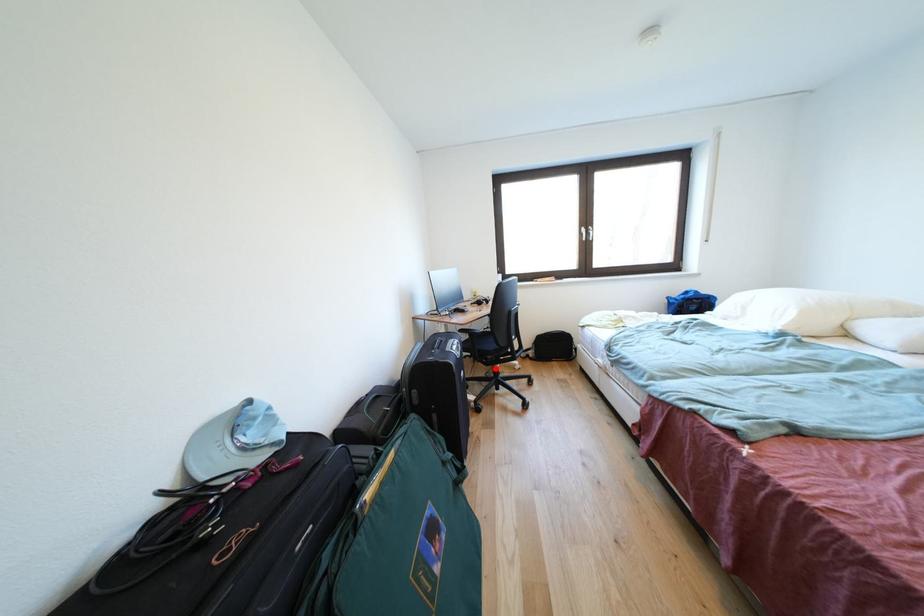
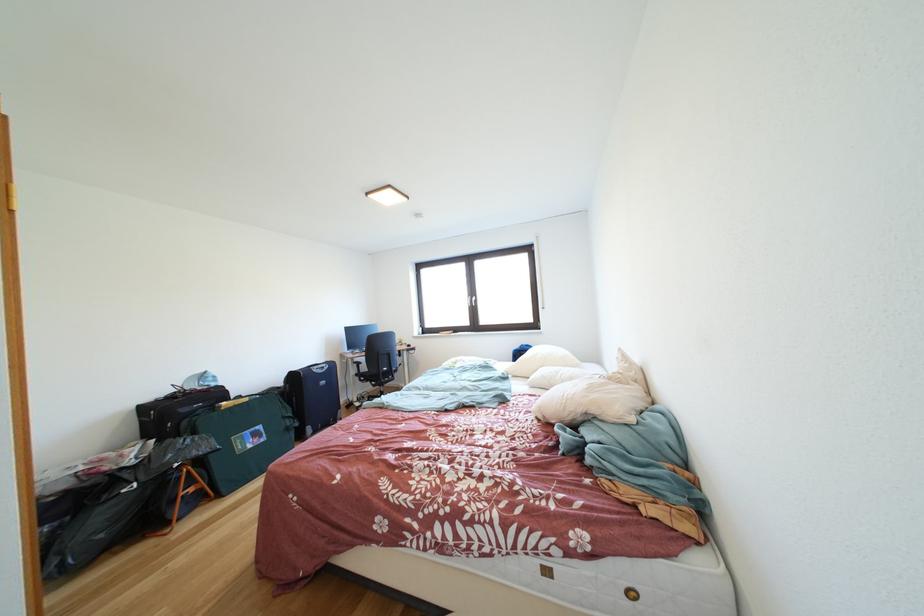
Find the pixel in the second image that matches the highlighted location in the first image.

(383, 391)